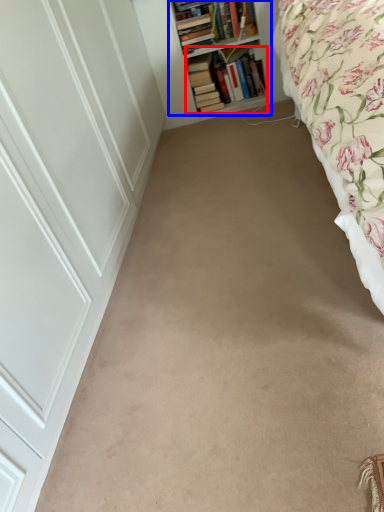
Question: Which point is closer to the camera, book (highlighted by a red box) or shelf (highlighted by a blue box)?

Choices:
 (A) book
 (B) shelf

Answer: (B)